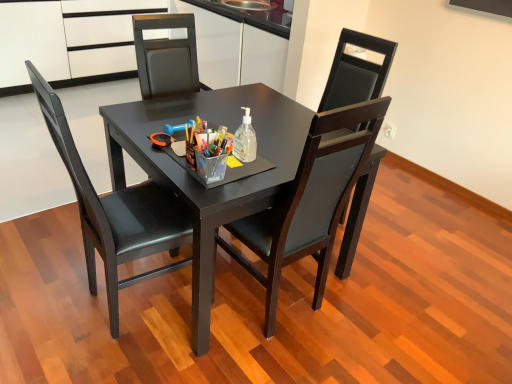
Find the location of a particular element. The height and width of the screenshot is (384, 512). free location to the right of clear plastic bottle at center is located at coordinates (279, 154).